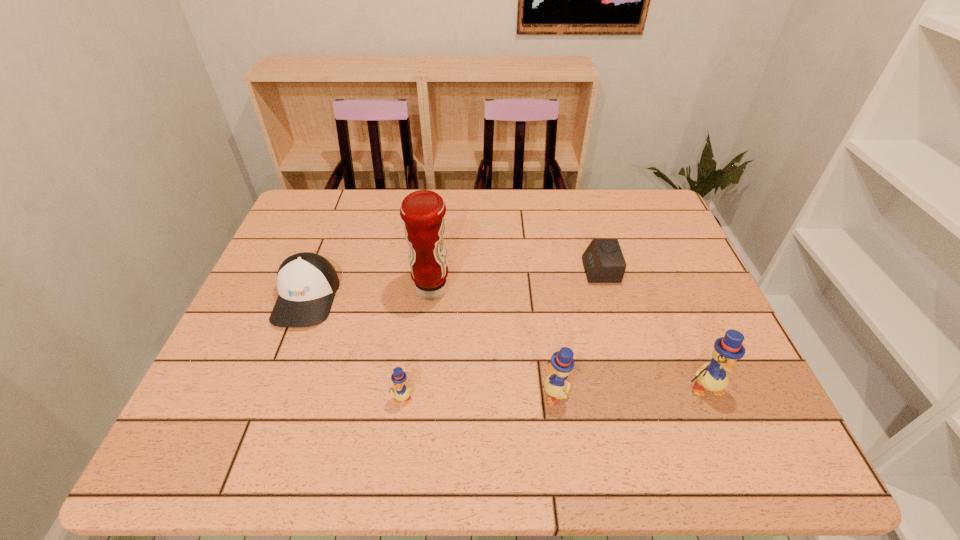
Find the location of a particular element. Image resolution: width=960 pixels, height=540 pixels. the leftmost duckling is located at coordinates (401, 393).

You are a GUI agent. You are given a task and a screenshot of the screen. Output one action in this format:
    pyautogui.click(x=<x>, y=<y>)
    Task: Click on the third object from right to left
    
    Given the screenshot: What is the action you would take?
    pyautogui.click(x=562, y=363)

You are a GUI agent. You are given a task and a screenshot of the screen. Output one action in this format:
    pyautogui.click(x=<x>, y=<y>)
    Task: Click on the second duckling from left to right
    
    Given the screenshot: What is the action you would take?
    pyautogui.click(x=562, y=363)

This screenshot has height=540, width=960. I want to click on the rightmost object, so click(712, 376).

At what (x,y) coordinates should I click in order to perform the action: click on the second object from right to left. Please return your answer as a coordinate pair (x, y). This screenshot has width=960, height=540. Looking at the image, I should click on (603, 260).

Where is `alarm clock`? The width and height of the screenshot is (960, 540). alarm clock is located at coordinates (603, 260).

Where is `condiment`? This screenshot has height=540, width=960. condiment is located at coordinates (422, 211).

Locate an element on the screen. Image resolution: width=960 pixels, height=540 pixels. cap is located at coordinates (307, 282).

This screenshot has height=540, width=960. I want to click on free space located on the face of the second tallest duckling, where the monocle is placed, so click(380, 393).

The height and width of the screenshot is (540, 960). I want to click on blank area located on the face of the second tallest duckling, where the monocle is placed, so click(477, 393).